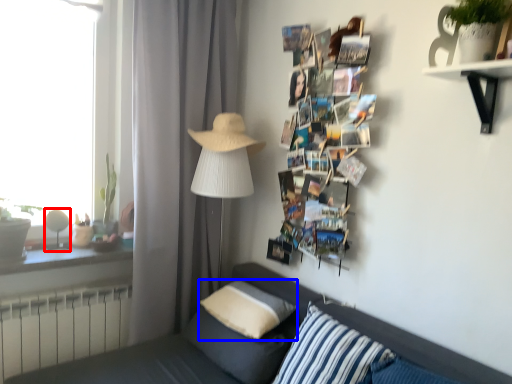
Question: Among these objects, which one is nearest to the camera, table lamp (highlighted by a red box) or pillow (highlighted by a blue box)?

Choices:
 (A) table lamp
 (B) pillow

Answer: (B)